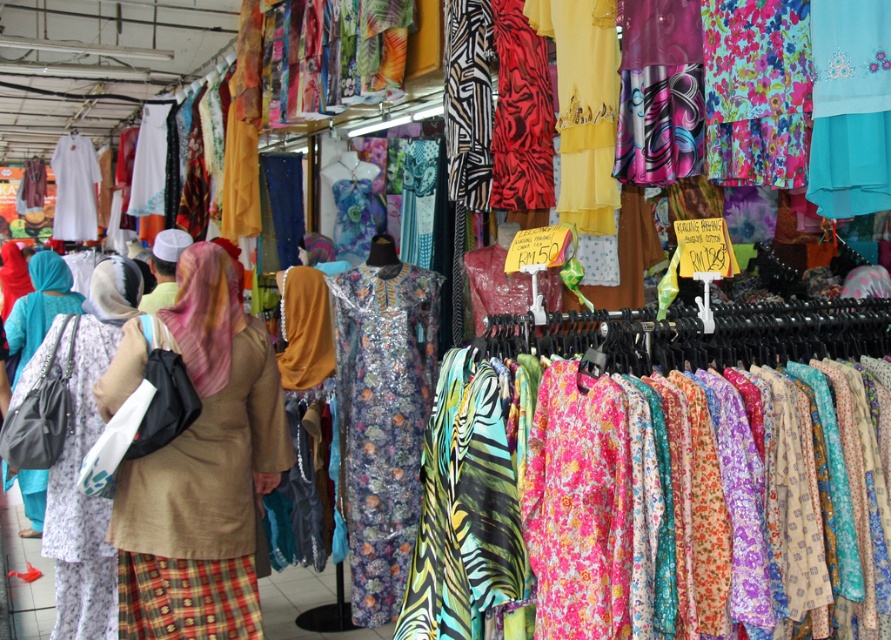
Does printed fabric dress at center have a greater width compared to beige fabric hijab at center?

Correct, the width of printed fabric dress at center exceeds that of beige fabric hijab at center.

Which is above, printed fabric dress at center or beige fabric hijab at center?

printed fabric dress at center

What are the coordinates of `printed fabric dress at center` in the screenshot? It's located at (524, 506).

Is point (562, 467) less distant than point (111, 563)?

Yes, point (562, 467) is closer to viewer.

Does printed fabric dress at center come in front of floral cotton dress at center?

Yes.

Who is more distant from viewer, (761,620) or (90,557)?

The point (90,557) is more distant.

Where is `printed fabric dress at center`? The width and height of the screenshot is (891, 640). printed fabric dress at center is located at coordinates (524, 506).

Between floral cotton dress at center and floral-patterned dress at left, which one has more height?

With more height is floral cotton dress at center.

Who is lower down, floral cotton dress at center or floral-patterned dress at left?

floral cotton dress at center is below.

The image size is (891, 640). I want to click on floral cotton dress at center, so [x=80, y=461].